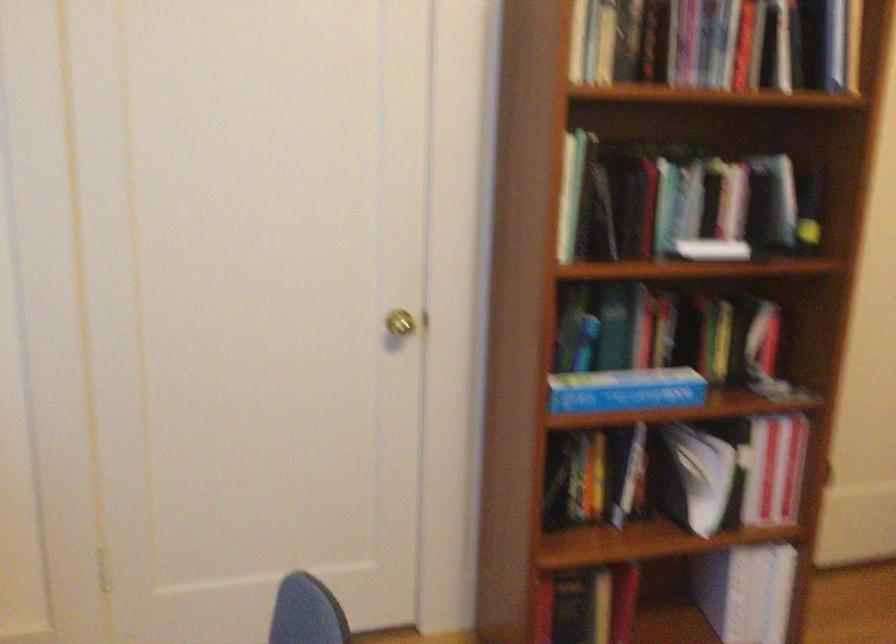
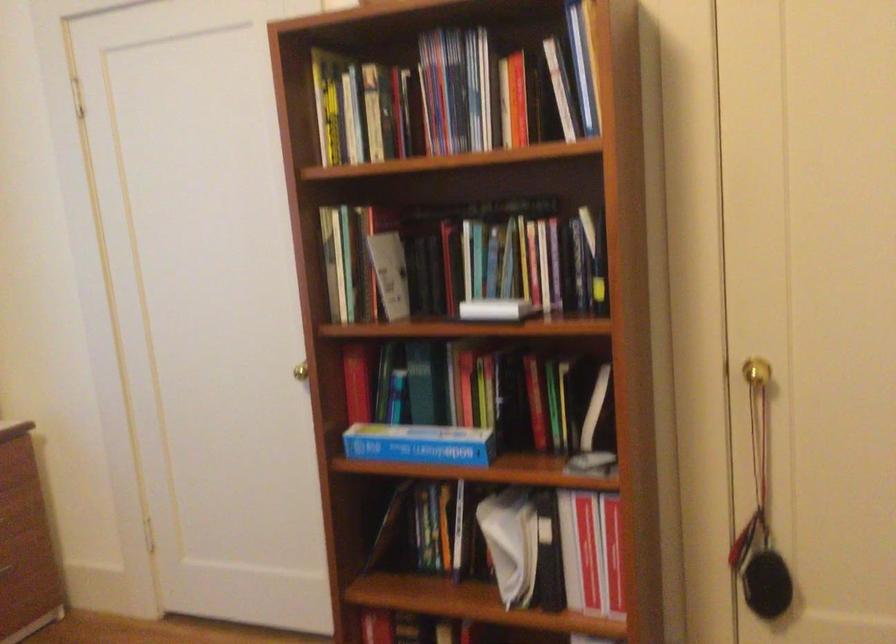
Find the pixel in the second image that matches pixel 712 247 in the first image.

(495, 308)